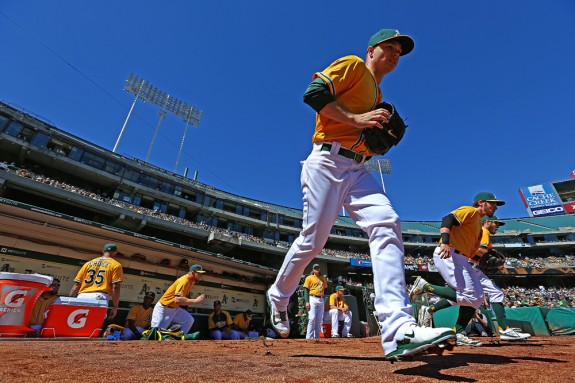
The height and width of the screenshot is (383, 575). I want to click on lights, so click(x=167, y=102).